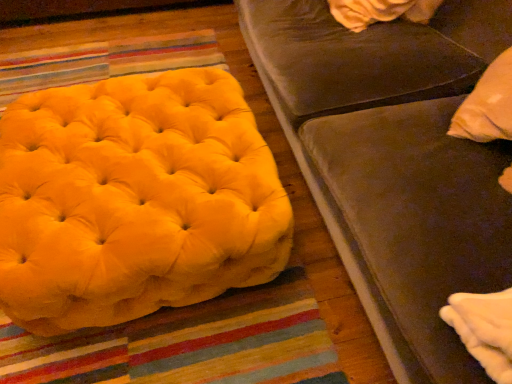
What do you see at coordinates (395, 162) in the screenshot?
I see `velvet brown studio couch at upper right` at bounding box center [395, 162].

At what (x,y) coordinates should I click in order to perform the action: click on velvet brown studio couch at upper right. Please return your answer as a coordinate pair (x, y). Looking at the image, I should click on (395, 162).

Describe the element at coordinates (135, 200) in the screenshot. I see `yellow velvet ottoman at left` at that location.

What is the approximate width of yellow velvet ottoman at left?

yellow velvet ottoman at left is 86.67 centimeters in width.

Find the location of a particular element. This screenshot has width=512, height=384. yellow velvet ottoman at left is located at coordinates (135, 200).

In order to face yellow velvet ottoman at left, should I rotate leftwards or rightwards?

To align with it, rotate left about 15.251°.

This screenshot has width=512, height=384. Find the location of `velvet brown studio couch at upper right`. velvet brown studio couch at upper right is located at coordinates (395, 162).

Between yellow velvet ottoman at left and velvet brown studio couch at upper right, which one appears on the right side from the viewer's perspective?

velvet brown studio couch at upper right is more to the right.

Does yellow velvet ottoman at left lie behind velvet brown studio couch at upper right?

Yes.

Considering the points (151, 287) and (330, 95), which point is behind, point (151, 287) or point (330, 95)?

Point (330, 95)

From the image's perspective, is yellow velvet ottoman at left positioned above or below velvet brown studio couch at upper right?

yellow velvet ottoman at left is situated lower than velvet brown studio couch at upper right in the image.

From a real-world perspective, is yellow velvet ottoman at left on velvet brown studio couch at upper right?

No, from a real-world perspective, yellow velvet ottoman at left is not over velvet brown studio couch at upper right

Considering the sizes of objects yellow velvet ottoman at left and velvet brown studio couch at upper right in the image provided, who is thinner, yellow velvet ottoman at left or velvet brown studio couch at upper right?

yellow velvet ottoman at left.

Who is shorter, yellow velvet ottoman at left or velvet brown studio couch at upper right?

yellow velvet ottoman at left is shorter.

Who is bigger, yellow velvet ottoman at left or velvet brown studio couch at upper right?

Bigger between the two is velvet brown studio couch at upper right.

Could velvet brown studio couch at upper right be considered to be inside yellow velvet ottoman at left?

No.

Are yellow velvet ottoman at left and velvet brown studio couch at upper right located far from each other?

That's not correct — yellow velvet ottoman at left is a little close to velvet brown studio couch at upper right.

Is velvet brown studio couch at upper right at the back of yellow velvet ottoman at left?

That's not correct — yellow velvet ottoman at left is not looking away from velvet brown studio couch at upper right.

Can you tell me how much yellow velvet ottoman at left and velvet brown studio couch at upper right differ in facing direction?

The facing directions of yellow velvet ottoman at left and velvet brown studio couch at upper right are 91.9 degrees apart.

Identify the location of furniture below the velvet brown studio couch at upper right (from the image's perspective). Image resolution: width=512 pixels, height=384 pixels. (135, 200).

Which object is positioned more to the right, velvet brown studio couch at upper right or yellow velvet ottoman at left?

velvet brown studio couch at upper right is more to the right.

Does velvet brown studio couch at upper right lie in front of yellow velvet ottoman at left?

Yes, velvet brown studio couch at upper right is closer to the viewer.

Is point (465, 220) closer to viewer compared to point (71, 316)?

Yes, it is.

From the image's perspective, who appears lower, velvet brown studio couch at upper right or yellow velvet ottoman at left?

yellow velvet ottoman at left appears lower in the image.

In the scene shown: From a real-world perspective, is velvet brown studio couch at upper right physically above yellow velvet ottoman at left?

Correct, in the physical world, velvet brown studio couch at upper right is higher than yellow velvet ottoman at left.

Which of these two, velvet brown studio couch at upper right or yellow velvet ottoman at left, is thinner?

Result: Thinner between the two is yellow velvet ottoman at left.

Can you confirm if velvet brown studio couch at upper right is shorter than yellow velvet ottoman at left?

No.

Is velvet brown studio couch at upper right bigger than yellow velvet ottoman at left?

Correct, velvet brown studio couch at upper right is larger in size than yellow velvet ottoman at left.

Can yellow velvet ottoman at left be found inside velvet brown studio couch at upper right?

No, yellow velvet ottoman at left is not surrounded by velvet brown studio couch at upper right.

Looking at this image, is velvet brown studio couch at upper right not near yellow velvet ottoman at left?

velvet brown studio couch at upper right is near yellow velvet ottoman at left, not far away.

Is velvet brown studio couch at upper right facing towards yellow velvet ottoman at left?

Yes, velvet brown studio couch at upper right is turned towards yellow velvet ottoman at left.

You are a GUI agent. You are given a task and a screenshot of the screen. Output one action in this format:
    pyautogui.click(x=<x>, y=<y>)
    Task: Click on the furniture lying behind the velvet brown studio couch at upper right
    This screenshot has height=384, width=512.
    Given the screenshot: What is the action you would take?
    pyautogui.click(x=135, y=200)

What are the coordinates of `studio couch above the yellow velvet ottoman at left (from the image's perspective)` in the screenshot? It's located at (395, 162).

At what (x,y) coordinates should I click in order to perform the action: click on furniture below the velvet brown studio couch at upper right (from a real-world perspective). Please return your answer as a coordinate pair (x, y). The height and width of the screenshot is (384, 512). Looking at the image, I should click on (135, 200).